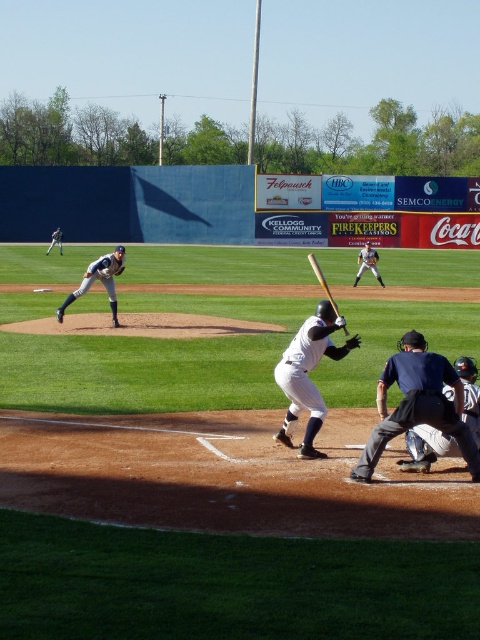
You are a coach observing the baseball game and notice two bats at center field. Which bat is positioned to the left of the other? The bats are labeled as the white matte baseball bat at center and the wooden baseball bat at center.

The white matte baseball bat at center is positioned to the left of the wooden baseball bat at center.